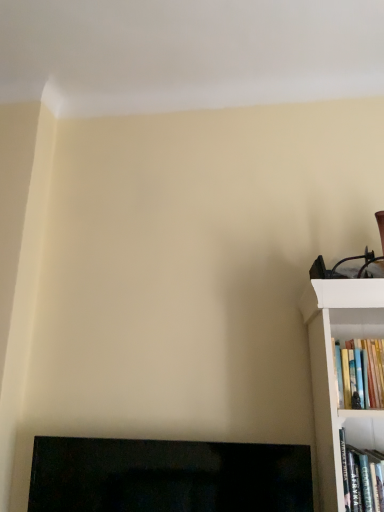
Question: Is hardcover book at right, the 1th book when ordered from bottom to top, positioned beyond the bounds of black glossy fireplace at lower left?

Choices:
 (A) no
 (B) yes

Answer: (B)

Question: Can you confirm if hardcover book at right, the 1th book when ordered from bottom to top, is taller than black glossy fireplace at lower left?

Choices:
 (A) yes
 (B) no

Answer: (B)

Question: Is hardcover book at right, the 1th book when ordered from bottom to top, oriented away from black glossy fireplace at lower left?

Choices:
 (A) no
 (B) yes

Answer: (A)

Question: Is hardcover book at right, which ranks as the second book in top-to-bottom order, aimed at black glossy fireplace at lower left?

Choices:
 (A) yes
 (B) no

Answer: (B)

Question: Based on their sizes in the image, would you say hardcover books at right, positioned as the first book in top-to-bottom order, is bigger or smaller than black glossy fireplace at lower left?

Choices:
 (A) small
 (B) big

Answer: (A)

Question: Considering the positions of hardcover books at right, placed as the second book when sorted from bottom to top, and black glossy fireplace at lower left in the image, is hardcover books at right, placed as the second book when sorted from bottom to top, taller or shorter than black glossy fireplace at lower left?

Choices:
 (A) short
 (B) tall

Answer: (A)

Question: From the image's perspective, is hardcover books at right, positioned as the first book in top-to-bottom order, located above or below black glossy fireplace at lower left?

Choices:
 (A) above
 (B) below

Answer: (A)

Question: Is hardcover books at right, positioned as the first book in top-to-bottom order, situated inside black glossy fireplace at lower left or outside?

Choices:
 (A) inside
 (B) outside

Answer: (B)

Question: From the image's perspective, is hardcover books at right, placed as the second book when sorted from bottom to top, positioned above or below hardcover book at right, the 1th book when ordered from bottom to top?

Choices:
 (A) above
 (B) below

Answer: (A)

Question: Which is correct: hardcover books at right, positioned as the first book in top-to-bottom order, is inside hardcover book at right, which ranks as the second book in top-to-bottom order, or outside of it?

Choices:
 (A) inside
 (B) outside

Answer: (B)

Question: Is point (382, 338) positioned closer to the camera than point (372, 508)?

Choices:
 (A) farther
 (B) closer

Answer: (A)

Question: In terms of height, does hardcover books at right, positioned as the first book in top-to-bottom order, look taller or shorter compared to hardcover book at right, the 1th book when ordered from bottom to top?

Choices:
 (A) short
 (B) tall

Answer: (B)

Question: In the image, is hardcover book at right, the 1th book when ordered from bottom to top, on the left side or the right side of black glossy fireplace at lower left?

Choices:
 (A) left
 (B) right

Answer: (B)

Question: Is point (372, 480) closer or farther from the camera than point (61, 467)?

Choices:
 (A) farther
 (B) closer

Answer: (B)